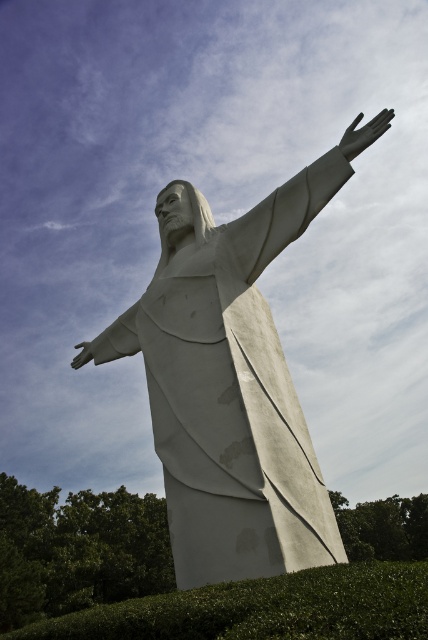
Who is more distant from viewer, [204,348] or [404,525]?

Point [404,525]

Which of these two, white marble statue at center or green leafy hedge at lower center, stands shorter?

white marble statue at center

Which is in front, point (351, 131) or point (315, 620)?

Point (315, 620) is in front.

Where is `white marble statue at center`? white marble statue at center is located at coordinates (231, 381).